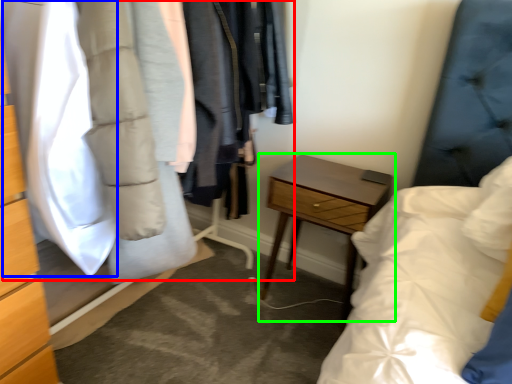
Question: Which object is the farthest from closet (highlighted by a red box)? Choose among these: clothing (highlighted by a blue box) or nightstand (highlighted by a green box).

Choices:
 (A) clothing
 (B) nightstand

Answer: (B)